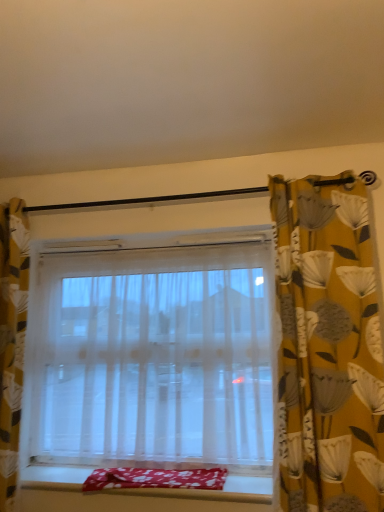
Question: Is smooth fabric window sill at lower center thinner than yellow floral fabric curtain at left, marked as the second curtain in a right-to-left arrangement?

Choices:
 (A) no
 (B) yes

Answer: (A)

Question: Can you confirm if smooth fabric window sill at lower center is wider than yellow floral fabric curtain at left, marked as the second curtain in a right-to-left arrangement?

Choices:
 (A) no
 (B) yes

Answer: (B)

Question: Is smooth fabric window sill at lower center oriented away from yellow floral fabric curtain at left, marked as the second curtain in a right-to-left arrangement?

Choices:
 (A) yes
 (B) no

Answer: (B)

Question: Is smooth fabric window sill at lower center not close to yellow floral fabric curtain at left, marked as the second curtain in a right-to-left arrangement?

Choices:
 (A) yes
 (B) no

Answer: (B)

Question: Is smooth fabric window sill at lower center touching yellow floral fabric curtain at left, which is the first curtain from left to right?

Choices:
 (A) yes
 (B) no

Answer: (B)

Question: Is smooth fabric window sill at lower center situated inside yellow floral fabric curtain at right, the first curtain in the right-to-left sequence, or outside?

Choices:
 (A) inside
 (B) outside

Answer: (B)

Question: Does point (142, 494) appear closer or farther from the camera than point (311, 324)?

Choices:
 (A) closer
 (B) farther

Answer: (B)

Question: From the image's perspective, is smooth fabric window sill at lower center positioned above or below yellow floral fabric curtain at right, the first curtain in the right-to-left sequence?

Choices:
 (A) above
 (B) below

Answer: (B)

Question: Is smooth fabric window sill at lower center wider or thinner than yellow floral fabric curtain at right, the 2th curtain when ordered from left to right?

Choices:
 (A) thin
 (B) wide

Answer: (B)

Question: In terms of width, does yellow floral fabric curtain at right, the 2th curtain when ordered from left to right, look wider or thinner when compared to floral cotton blanket at lower center?

Choices:
 (A) thin
 (B) wide

Answer: (A)

Question: From the image's perspective, is yellow floral fabric curtain at right, the first curtain in the right-to-left sequence, above or below floral cotton blanket at lower center?

Choices:
 (A) below
 (B) above

Answer: (B)

Question: In terms of size, does yellow floral fabric curtain at right, the first curtain in the right-to-left sequence, appear bigger or smaller than floral cotton blanket at lower center?

Choices:
 (A) big
 (B) small

Answer: (A)

Question: Would you say yellow floral fabric curtain at right, the 2th curtain when ordered from left to right, is inside or outside floral cotton blanket at lower center?

Choices:
 (A) outside
 (B) inside

Answer: (A)

Question: Is yellow floral fabric curtain at right, the first curtain in the right-to-left sequence, to the left or to the right of transparent fabric window at center in the image?

Choices:
 (A) left
 (B) right

Answer: (B)

Question: From a real-world perspective, is yellow floral fabric curtain at right, the first curtain in the right-to-left sequence, physically located above or below transparent fabric window at center?

Choices:
 (A) below
 (B) above

Answer: (B)